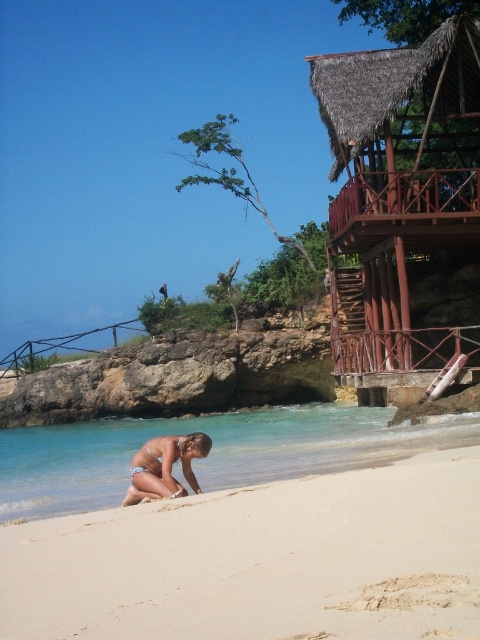
You are a tourist on the beach and want to take a photo of both the thatched wood hut at upper right and the clear blue water at lower center in the same frame. Based on their sizes in the image, which object should you position closer to the center of the photo to ensure both are visible?

The thatched wood hut at upper right is smaller than the clear blue water at lower center, so you should position the thatched wood hut at upper right closer to the center of the photo to ensure both are visible.

You are standing at the point marked as point (x=193, y=461) on the beach. What do you see directly in front of you?

You see clear blue water at lower center directly in front of you at point (x=193, y=461).